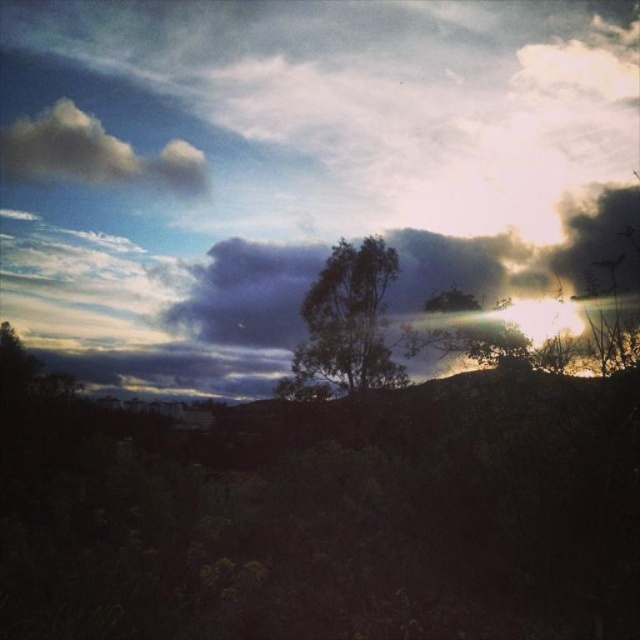
Question: Can you confirm if dark gray cloud at upper center is positioned to the left of green leafy tree at center?

Choices:
 (A) no
 (B) yes

Answer: (B)

Question: Is dark gray cloud at upper center to the left of white fluffy cloud at upper left from the viewer's perspective?

Choices:
 (A) yes
 (B) no

Answer: (B)

Question: Which object is closer to the camera taking this photo?

Choices:
 (A) green leafy tree at center
 (B) dark gray cloud at upper center

Answer: (A)

Question: Considering the real-world distances, which object is closest to the green leafy tree at center?

Choices:
 (A) dark gray cloud at upper center
 (B) white fluffy cloud at upper left

Answer: (A)

Question: Observing the image, what is the correct spatial positioning of dark gray cloud at upper center in reference to green leafy tree at center?

Choices:
 (A) above
 (B) below

Answer: (A)

Question: Which of these objects is positioned closest to the dark gray cloud at upper center?

Choices:
 (A) white fluffy cloud at upper left
 (B) green leafy tree at center

Answer: (B)